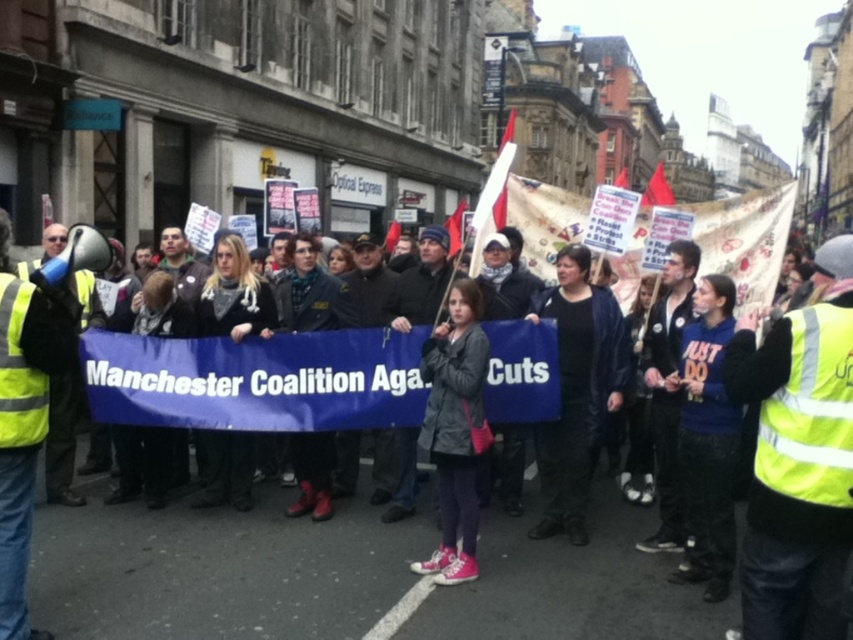
You are a photographer trying to capture a clear shot of the yellow reflective vest at center and the dark gray jacket at center. Based on their sizes in the image, which object should you focus on first to ensure it is in sharp focus?

The yellow reflective vest at center is much taller than the dark gray jacket at center, so you should focus on the yellow reflective vest at center first to ensure it is in sharp focus since it is larger in the frame.

You are a photographer trying to capture a photo of the protest scene. You notice two jackets in the crowd at the center of the image. The black leather jacket at center and the dark gray jacket at center. Which jacket is positioned to the right of the other?

The black leather jacket at center is positioned to the right of the dark gray jacket at center.